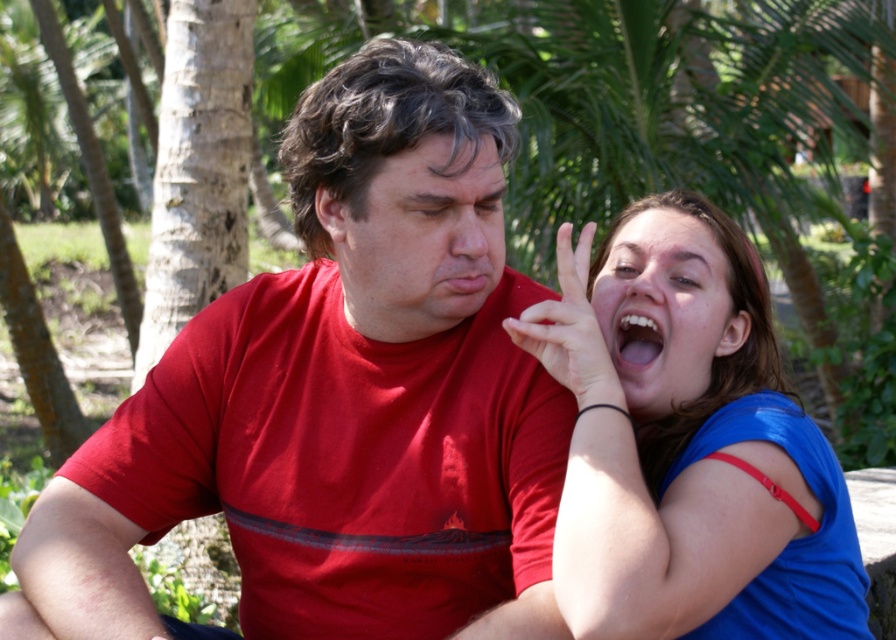
Is blue shiny tank top at right to the left of white glossy teeth at center from the viewer's perspective?

No, blue shiny tank top at right is not to the left of white glossy teeth at center.

Who is lower down, blue shiny tank top at right or white glossy teeth at center?

blue shiny tank top at right is lower down.

Which is behind, point (633, 477) or point (630, 355)?

The point (630, 355) is more distant.

Identify the location of blue shiny tank top at right. This screenshot has height=640, width=896. (688, 445).

Is blue matte face at upper right bigger than matte skin hand at upper right?

Indeed, blue matte face at upper right has a larger size compared to matte skin hand at upper right.

Does point (622, 352) come in front of point (580, 365)?

No, it is behind (580, 365).

Between point (636, 291) and point (600, 396), which one is positioned in front?

Point (600, 396) is more forward.

Find the location of a particular element. blue matte face at upper right is located at coordinates (665, 308).

Can you confirm if matte skin hand at upper right is positioned above white glossy teeth at center?

Yes.

Is matte skin hand at upper right to the left of white glossy teeth at center from the viewer's perspective?

Correct, you'll find matte skin hand at upper right to the left of white glossy teeth at center.

Image resolution: width=896 pixels, height=640 pixels. What do you see at coordinates (570, 330) in the screenshot?
I see `matte skin hand at upper right` at bounding box center [570, 330].

In order to click on matte skin hand at upper right in this screenshot , I will do `click(570, 330)`.